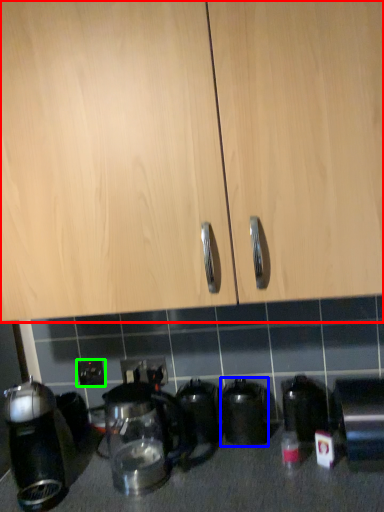
Question: Estimate the real-world distances between objects in this image. Which object is farther from cabinetry (highlighted by a red box), kitchen appliance (highlighted by a blue box) or electric outlet (highlighted by a green box)?

Choices:
 (A) kitchen appliance
 (B) electric outlet

Answer: (B)